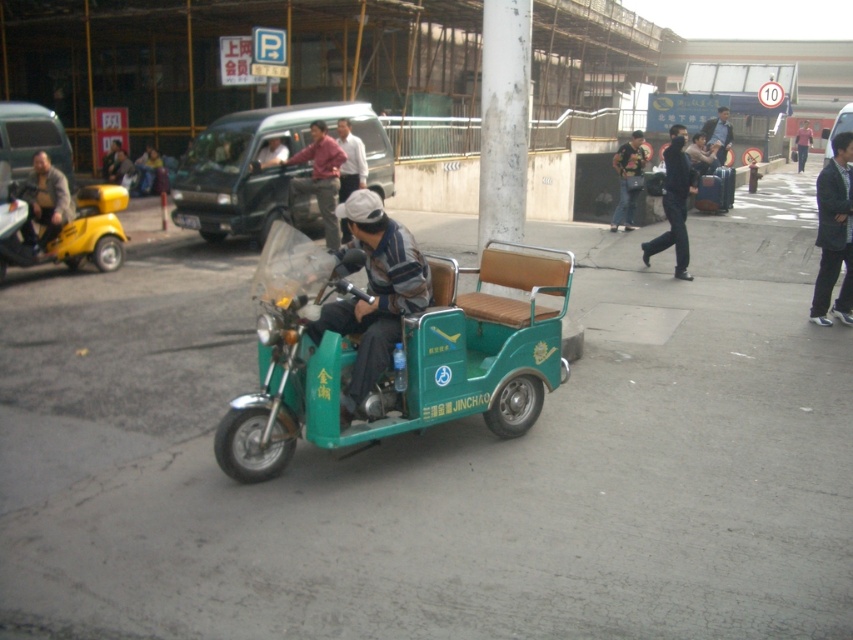
Please look at the image. There is a point marked at coordinates [834,232]. What object is located at this point? The options are the green three wheeled vehicle labeled JINCHAO or the yellow scooter.

The point at coordinates [834,232] indicates the black fabric jacket at right, which is not one of the listed options. However, based on the provided information, the closest object from the options would be the yellow scooter since it is positioned on the left side of the frame and the jacket is at the right.